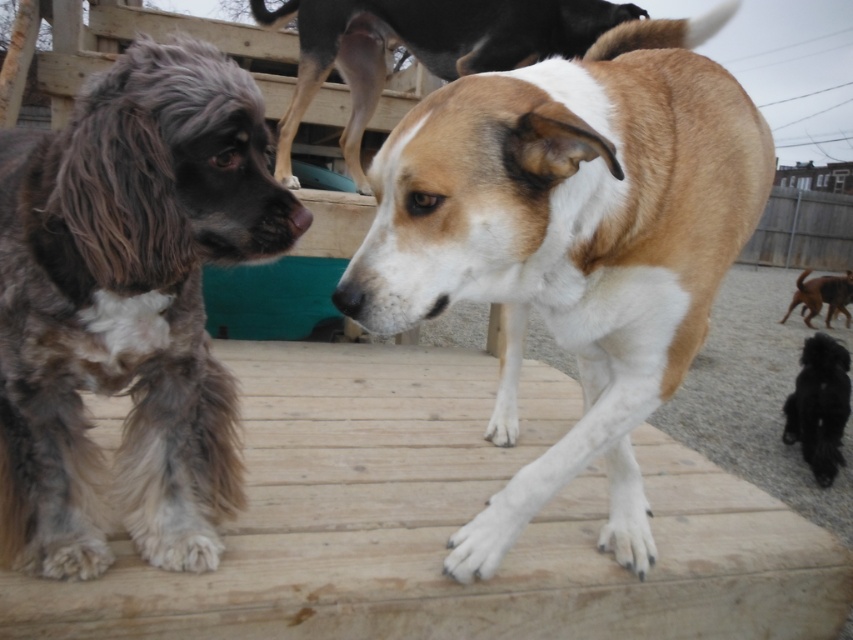
Question: Which point appears closest to the camera in this image?

Choices:
 (A) (577, 348)
 (B) (799, 275)
 (C) (781, 554)

Answer: (A)

Question: Does wooden deck at center appear on the right side of brown/white fur dog at upper center?

Choices:
 (A) no
 (B) yes

Answer: (A)

Question: Is wooden deck at center to the left of gray fluffy dog at left from the viewer's perspective?

Choices:
 (A) no
 (B) yes

Answer: (A)

Question: Which point is closer to the camera taking this photo?

Choices:
 (A) (566, 40)
 (B) (805, 387)
 (C) (798, 301)

Answer: (A)

Question: Can you confirm if wooden deck at center is positioned to the right of black fluffy dog at lower right?

Choices:
 (A) no
 (B) yes

Answer: (A)

Question: Which object appears farthest from the camera in this image?

Choices:
 (A) brown furry dog at lower right
 (B) brown/white fur dog at upper center
 (C) brown/white fur dog at center
 (D) wooden deck at center

Answer: (A)